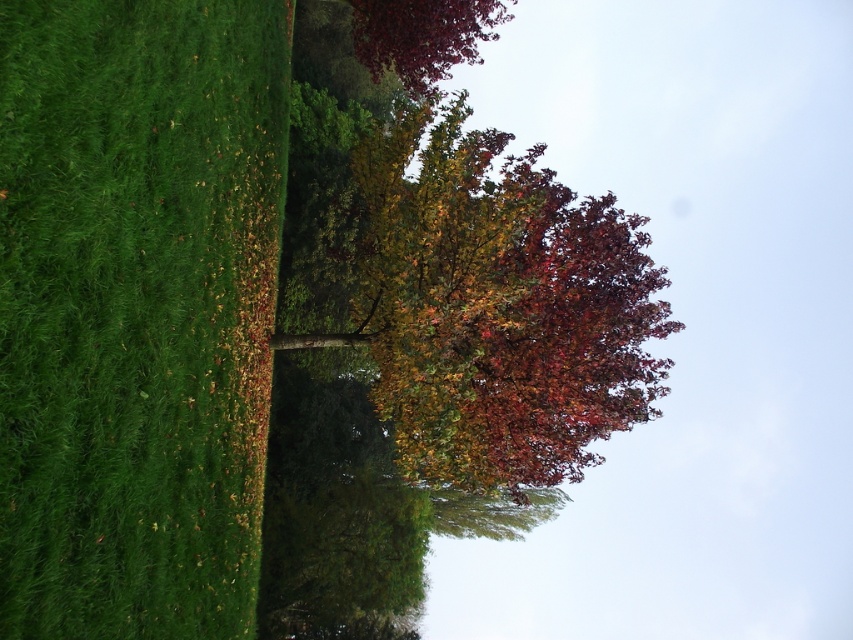
Does point (120, 144) come behind point (438, 248)?

No.

You are a GUI agent. You are given a task and a screenshot of the screen. Output one action in this format:
    pyautogui.click(x=<x>, y=<y>)
    Task: Click on the green grassy hedge at left
    Image resolution: width=853 pixels, height=640 pixels.
    Given the screenshot: What is the action you would take?
    (x=136, y=310)

Between point (216, 291) and point (415, 51), which one is positioned in front?

Point (216, 291) is in front.

The image size is (853, 640). I want to click on green grassy hedge at left, so click(136, 310).

Is multicolored foliage at center below shiny burgundy leaves at upper center?

Indeed, multicolored foliage at center is positioned under shiny burgundy leaves at upper center.

In the scene shown: Does multicolored foliage at center appear over shiny burgundy leaves at upper center?

No.

Is point (570, 472) positioned before point (437, 8)?

Yes.

Find the location of a particular element. The width and height of the screenshot is (853, 640). multicolored foliage at center is located at coordinates (494, 305).